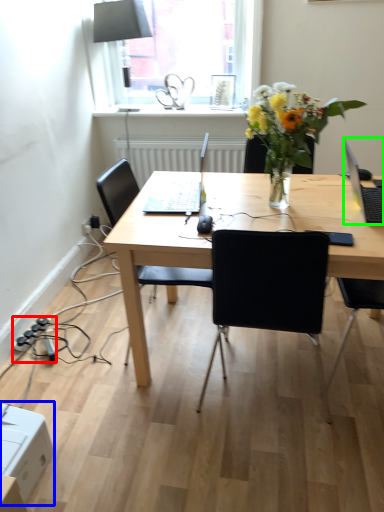
Question: Estimate the real-world distances between objects in this image. Which object is farther from power plugs and sockets (highlighted by a red box), cardboard box (highlighted by a blue box) or laptop (highlighted by a green box)?

Choices:
 (A) cardboard box
 (B) laptop

Answer: (B)